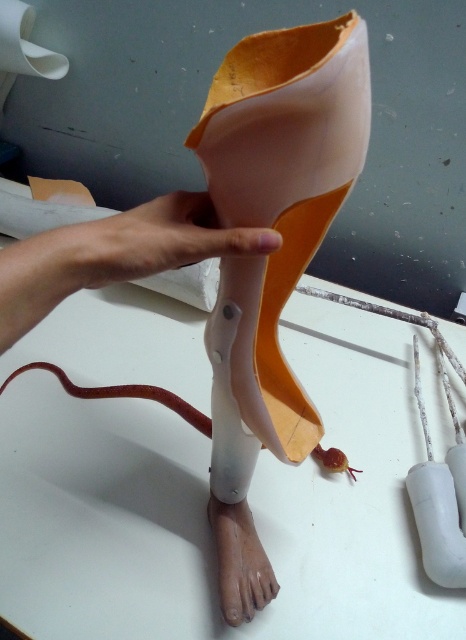
Can you confirm if smooth skin hand at center is bigger than matte plastic foot at lower center?

Yes, smooth skin hand at center is bigger than matte plastic foot at lower center.

Is smooth skin hand at center positioned at the back of matte plastic foot at lower center?

No, smooth skin hand at center is closer to the viewer.

Which is behind, point (139, 269) or point (241, 538)?

The point (241, 538) is more distant.

At what (x,y) coordinates should I click in order to perform the action: click on smooth skin hand at center. Please return your answer as a coordinate pair (x, y). This screenshot has width=466, height=640. Looking at the image, I should click on (164, 240).

Between point (6, 314) and point (248, 529), which one is positioned in front?

Point (6, 314) is in front.

Does matte plastic leg at center have a smaller size compared to matte plastic foot at lower center?

Actually, matte plastic leg at center might be larger than matte plastic foot at lower center.

The image size is (466, 640). I want to click on matte plastic leg at center, so click(x=114, y=253).

Is point (84, 275) positioned behind point (95, 257)?

Yes.

Is matte plastic leg at center smaller than smooth skin hand at center?

Actually, matte plastic leg at center might be larger than smooth skin hand at center.

Find the location of a particular element. matte plastic leg at center is located at coordinates (114, 253).